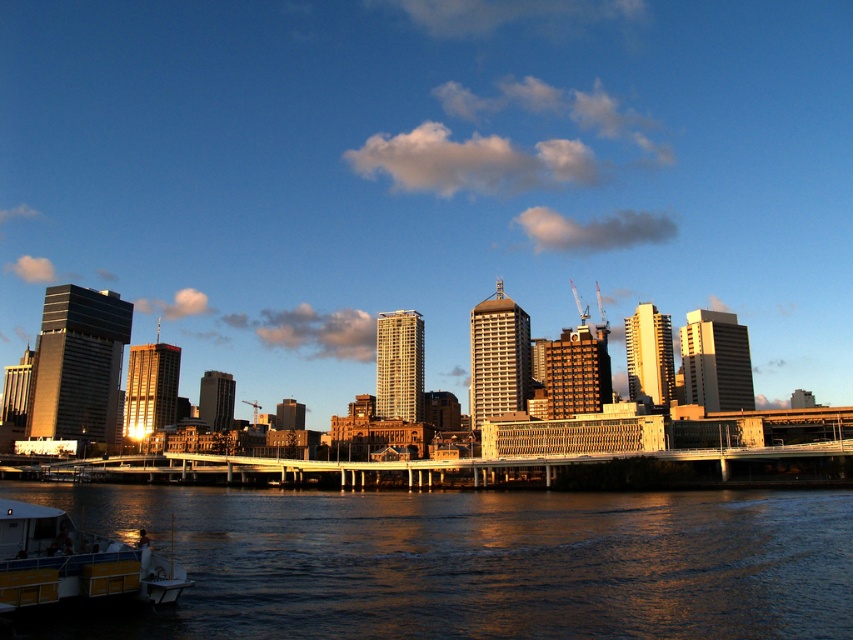
Does dark reflective water at lower left have a lesser height compared to yellow plastic boat at lower left?

No.

Can you confirm if dark reflective water at lower left is bigger than yellow plastic boat at lower left?

Correct, dark reflective water at lower left is larger in size than yellow plastic boat at lower left.

Does point (589, 540) come in front of point (111, 593)?

That is False.

Where is `dark reflective water at lower left`? Image resolution: width=853 pixels, height=640 pixels. dark reflective water at lower left is located at coordinates (474, 563).